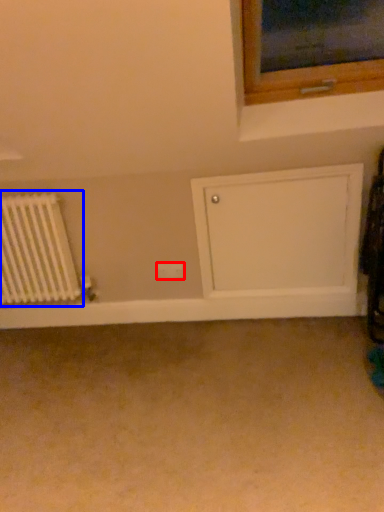
Question: Which point is further to the camera, electric outlet (highlighted by a red box) or radiator (highlighted by a blue box)?

Choices:
 (A) electric outlet
 (B) radiator

Answer: (A)